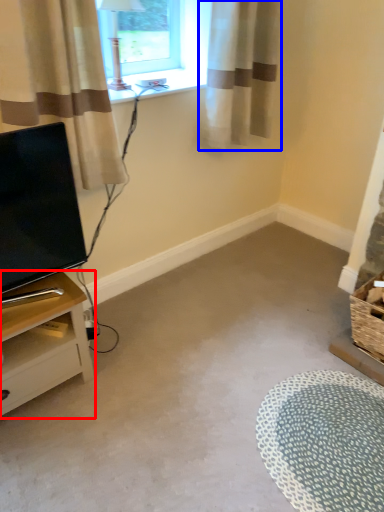
Question: Which point is closer to the camera, nightstand (highlighted by a red box) or curtain (highlighted by a blue box)?

Choices:
 (A) nightstand
 (B) curtain

Answer: (A)